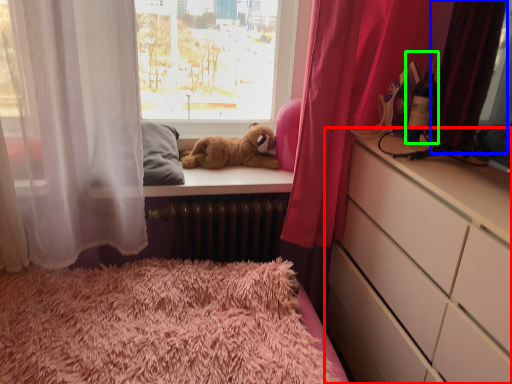
Question: Based on their relative distances, which object is farther from chest of drawers (highlighted by a red box)? Choose from curtain (highlighted by a blue box) and bottle (highlighted by a green box).

Choices:
 (A) curtain
 (B) bottle

Answer: (B)